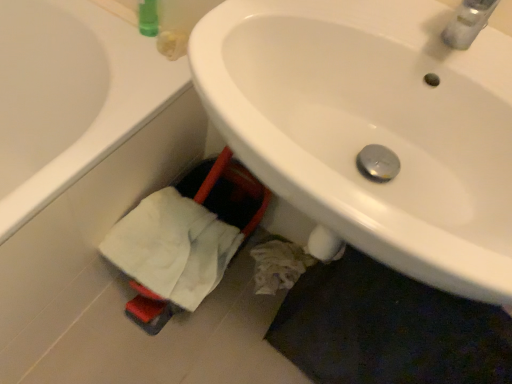
What do you see at coordinates (172, 247) in the screenshot? The height and width of the screenshot is (384, 512). I see `white cotton bath towel at lower left` at bounding box center [172, 247].

The height and width of the screenshot is (384, 512). Identify the location of white glossy sink at center. (371, 129).

In order to face white matte bathtub at lower left, should I rotate leftwards or rightwards?

To align with it, rotate left about 30.468°.

What are the coordinates of `white cotton bath towel at lower left` in the screenshot? It's located at (172, 247).

Who is more distant, white matte bathtub at lower left or white cotton bath towel at lower left?

white cotton bath towel at lower left is further away from the camera.

Is white matte bathtub at lower left not within white cotton bath towel at lower left?

Yes.

Considering the sizes of white matte bathtub at lower left and white cotton bath towel at lower left in the image, is white matte bathtub at lower left bigger or smaller than white cotton bath towel at lower left?

Clearly, white matte bathtub at lower left is larger in size than white cotton bath towel at lower left.

From a real-world perspective, which object stands above the other?

In real-world perspective, white cotton bath towel at lower left is above.

Based on their positions, is white cotton bath towel at lower left located to the left or right of white glossy sink at center?

white cotton bath towel at lower left is positioned on white glossy sink at center's left side.

Is white cotton bath towel at lower left turned away from white glossy sink at center?

That's right, white cotton bath towel at lower left is facing away from white glossy sink at center.

From the image's perspective, is white cotton bath towel at lower left under white glossy sink at center?

A: Yes, from the image's perspective, white cotton bath towel at lower left is below white glossy sink at center.

From the image's perspective, between white glossy sink at center and white matte bathtub at lower left, which one is located above?

white matte bathtub at lower left is shown above in the image.

Based on the photo, who is shorter, white glossy sink at center or white matte bathtub at lower left?

With less height is white matte bathtub at lower left.

Where is `sink above the white matte bathtub at lower left (from a real-world perspective)`? Image resolution: width=512 pixels, height=384 pixels. sink above the white matte bathtub at lower left (from a real-world perspective) is located at coordinates (371, 129).

Is white glossy sink at center smaller than white matte bathtub at lower left?

Indeed, white glossy sink at center has a smaller size compared to white matte bathtub at lower left.

Considering the sizes of objects white cotton bath towel at lower left and white matte bathtub at lower left in the image provided, who is smaller, white cotton bath towel at lower left or white matte bathtub at lower left?

white cotton bath towel at lower left.

From a real-world perspective, which object stands above the other?

white cotton bath towel at lower left.

Can you confirm if white cotton bath towel at lower left is taller than white matte bathtub at lower left?

No, white cotton bath towel at lower left is not taller than white matte bathtub at lower left.

From the image's perspective, who appears lower, white cotton bath towel at lower left or white matte bathtub at lower left?

white cotton bath towel at lower left.

Is white glossy sink at center surrounded by white matte bathtub at lower left?

No.

Which is in front, point (126, 85) or point (511, 207)?

The point (511, 207) is more forward.

Visually, is white matte bathtub at lower left positioned to the left or to the right of white glossy sink at center?

Based on their positions, white matte bathtub at lower left is located to the left of white glossy sink at center.

Which of these two, white glossy sink at center or white cotton bath towel at lower left, is bigger?

With larger size is white glossy sink at center.

This screenshot has width=512, height=384. I want to click on bath towel located below the white glossy sink at center (from the image's perspective), so click(x=172, y=247).

From the picture: From a real-world perspective, is white glossy sink at center physically located above or below white cotton bath towel at lower left?

In terms of real-world spatial position, white glossy sink at center is above white cotton bath towel at lower left.

Locate an element on the screen. bath towel that is below the white matte bathtub at lower left (from the image's perspective) is located at coordinates [x=172, y=247].

Find the location of `bath towel located underneath the white glossy sink at center (from a real-world perspective)`. bath towel located underneath the white glossy sink at center (from a real-world perspective) is located at coordinates (172, 247).

Which object lies further to the anchor point white glossy sink at center, white cotton bath towel at lower left or white matte bathtub at lower left?

Among the two, white matte bathtub at lower left is located further to white glossy sink at center.

Estimate the real-world distances between objects in this image. Which object is further from white matte bathtub at lower left, white glossy sink at center or white cotton bath towel at lower left?

white glossy sink at center is positioned further to the anchor white matte bathtub at lower left.

Estimate the real-world distances between objects in this image. Which object is closer to white matte bathtub at lower left, white cotton bath towel at lower left or white glossy sink at center?

white cotton bath towel at lower left is closer to white matte bathtub at lower left.

Based on their spatial positions, is white matte bathtub at lower left or white glossy sink at center further from white cotton bath towel at lower left?

The object further to white cotton bath towel at lower left is white glossy sink at center.

When comparing their distances from white cotton bath towel at lower left, does white glossy sink at center or white matte bathtub at lower left seem closer?

The object closer to white cotton bath towel at lower left is white matte bathtub at lower left.

Looking at the image, which one is located further to white glossy sink at center, white matte bathtub at lower left or white cotton bath towel at lower left?

The object further to white glossy sink at center is white matte bathtub at lower left.

Where is `bath towel between white matte bathtub at lower left and white glossy sink at center`? This screenshot has width=512, height=384. bath towel between white matte bathtub at lower left and white glossy sink at center is located at coordinates (172, 247).